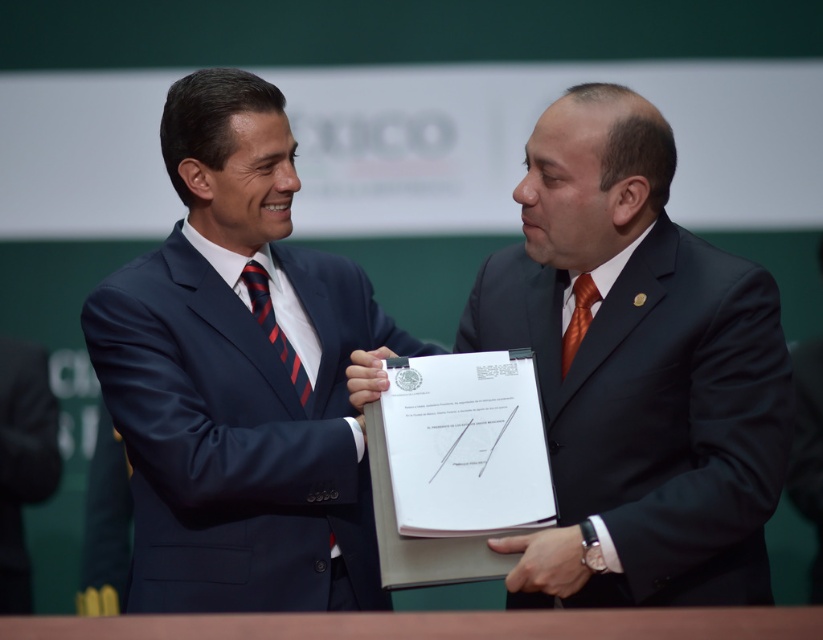
You are an event planner organizing a formal ceremony. You need to ensure that the matte black suit at center and the white paper clipboard at center are positioned so that the clipboard is clearly visible to the attendees. Given their sizes, which object should be placed closer to the front to ensure visibility?

The white paper clipboard at center should be placed closer to the front because the matte black suit at center is wider, so positioning the smaller clipboard forward ensures it remains visible to the attendees.